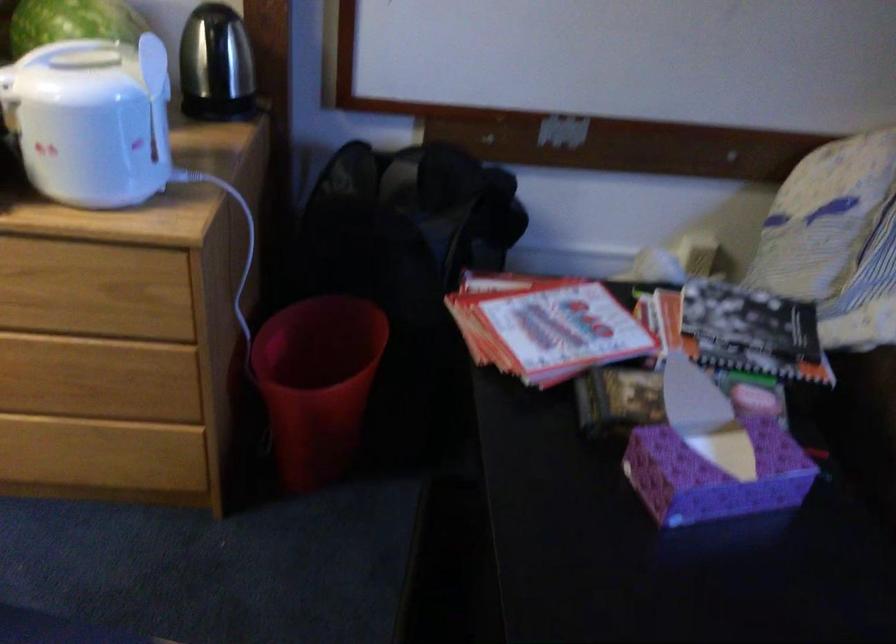
Where is `tissue from box`? The image size is (896, 644). tissue from box is located at coordinates (714, 475).